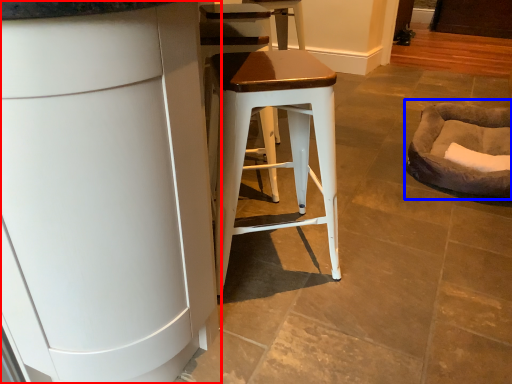
Question: Which point is closer to the camera, cabinetry (highlighted by a red box) or bean bag chair (highlighted by a blue box)?

Choices:
 (A) cabinetry
 (B) bean bag chair

Answer: (A)